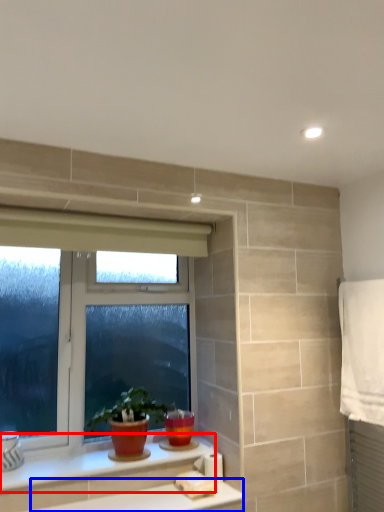
Question: Which point is closer to the camera, counter top (highlighted by a red box) or counter top (highlighted by a blue box)?

Choices:
 (A) counter top
 (B) counter top

Answer: (B)